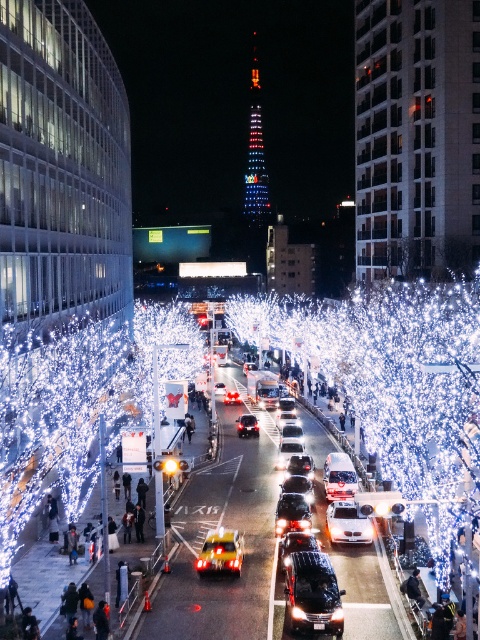
Which is above, shiny gold car at center or glossy metallic car at center?

glossy metallic car at center

Who is positioned more to the right, shiny gold car at center or glossy metallic car at center?

glossy metallic car at center

Between point (197, 557) and point (252, 417), which one is positioned behind?

The point (252, 417) is more distant.

In order to click on shiny gold car at center in this screenshot , I will do tap(220, 552).

Which is above, shiny gold car at center or white glossy car at center?

white glossy car at center is above.

Does point (215, 545) come in front of point (328, 529)?

Yes, it is in front of point (328, 529).

Locate an element on the screen. shiny gold car at center is located at coordinates (220, 552).

I want to click on shiny gold car at center, so click(x=220, y=552).

Is illuminated wire at center shorter than glossy metallic car at center?

In fact, illuminated wire at center may be taller than glossy metallic car at center.

Who is taller, illuminated wire at center or glossy metallic car at center?

Standing taller between the two is illuminated wire at center.

Is point (367, 305) positioned before point (249, 433)?

That is False.

Find the location of a particular element. This screenshot has width=480, height=640. illuminated wire at center is located at coordinates tap(395, 381).